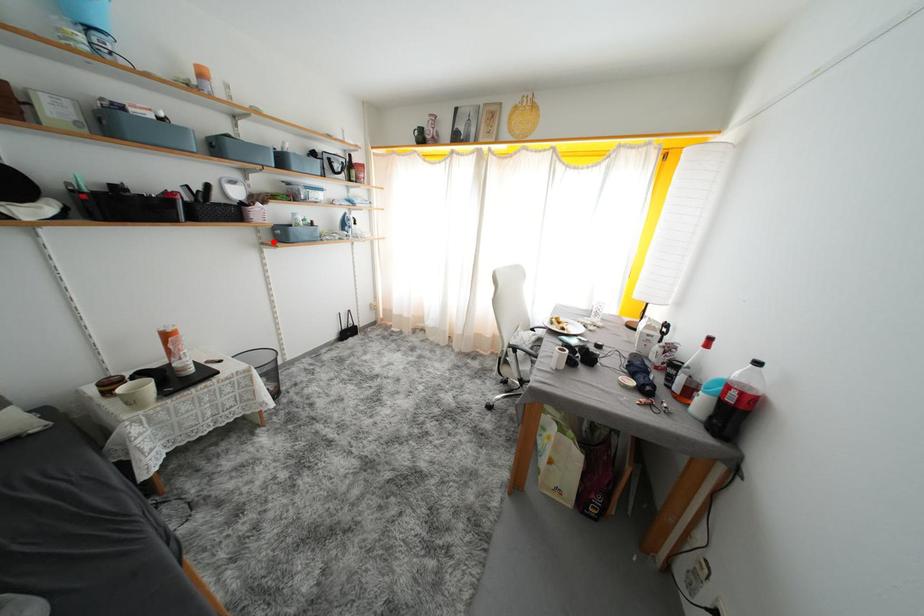
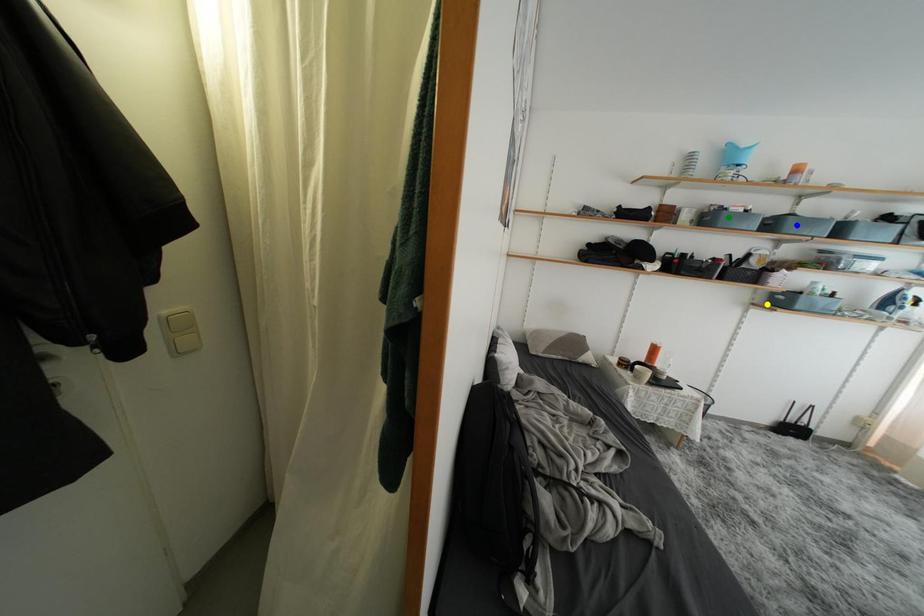
Question: I am providing you with two images of the same scene from different viewpoints. A red point is marked on the first image. You are given multiple points on the second image. Which point in image 2 represents the same 3d spot as the red point in image 1?

Choices:
 (A) blue point
 (B) green point
 (C) yellow point

Answer: (C)